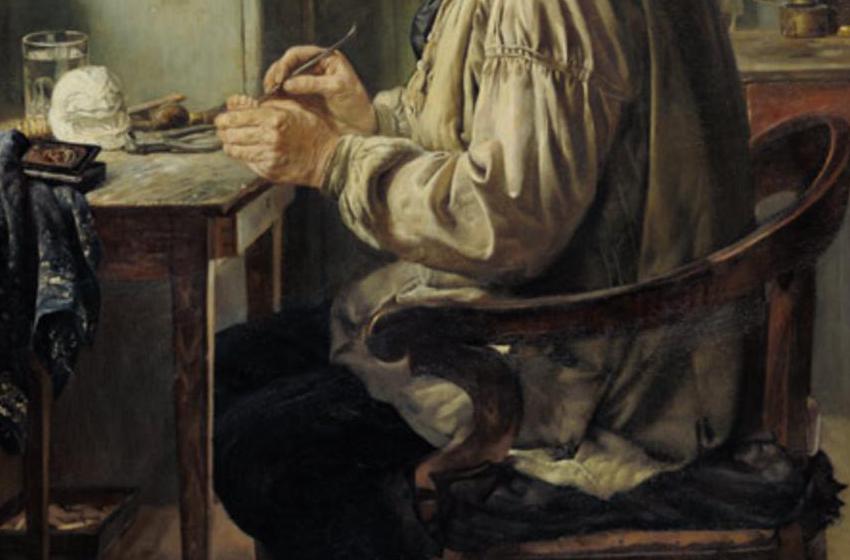
Where is `chair`? The image size is (850, 560). chair is located at coordinates (518, 326), (669, 281), (796, 251), (817, 158), (658, 489), (552, 493).